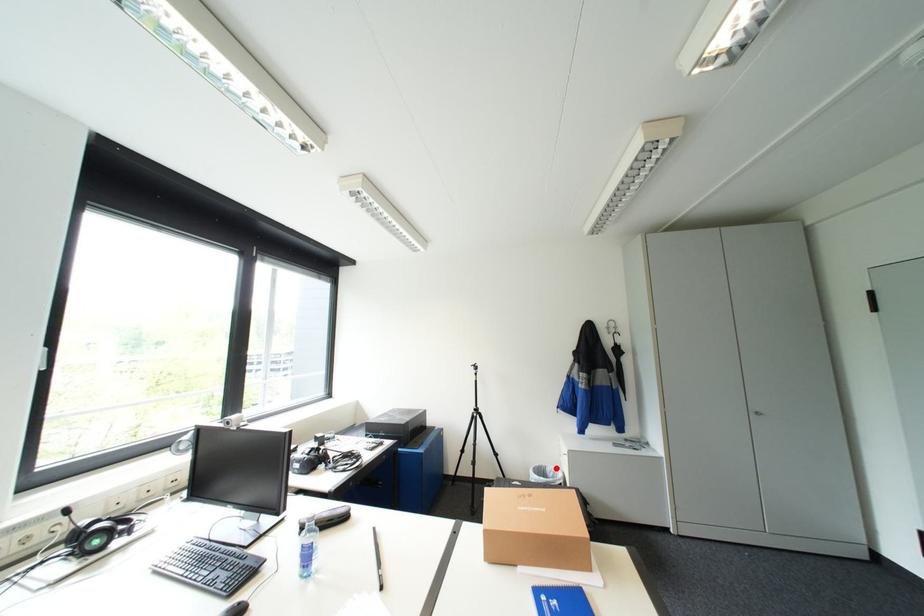
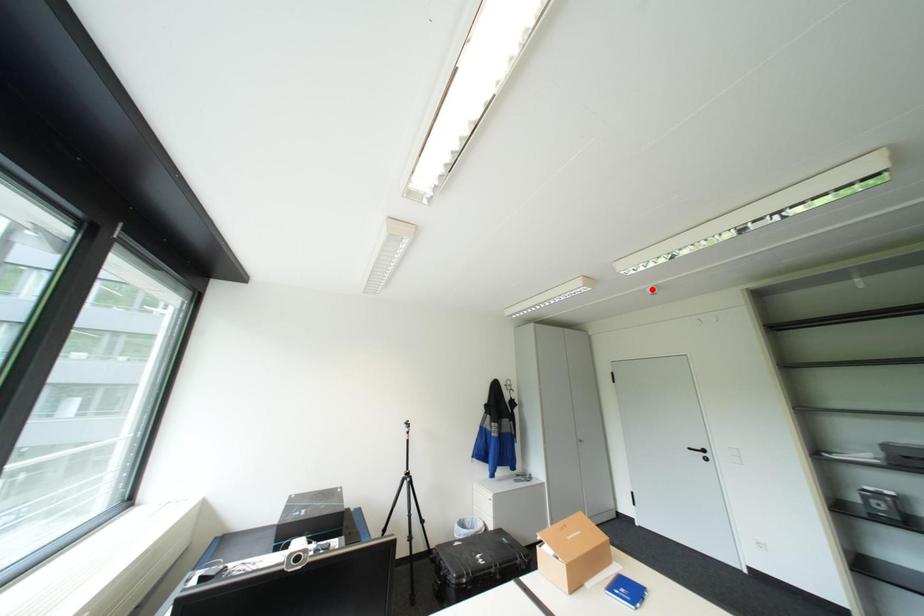
I am providing you with two images of the same scene from different viewpoints. A red point is marked on the first image and another point is marked on the second image. Do the highlighted points in image1 and image2 indicate the same real-world spot?

No